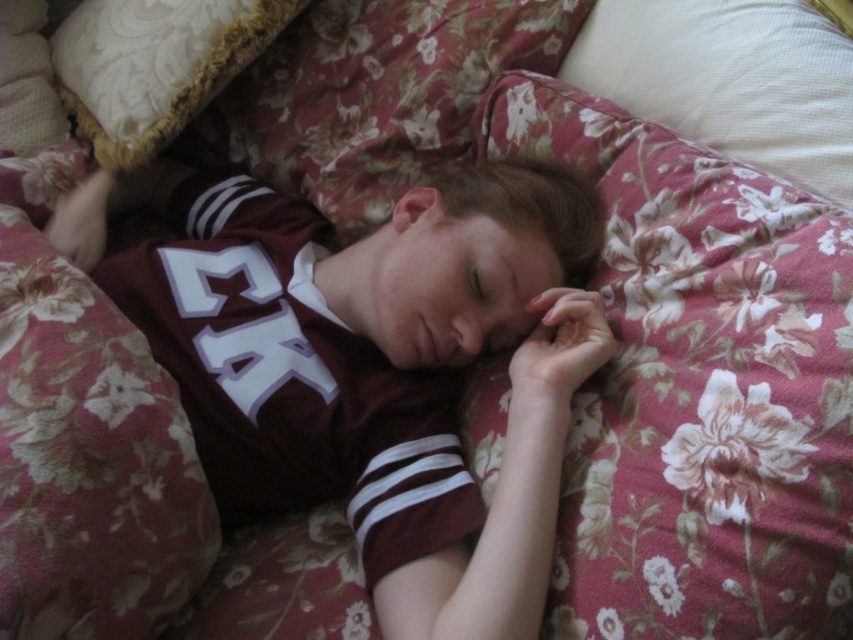
You are a photographer setting up a shoot in this scene. You need to place a small prop between the maroon jersey at center and the white textured pillow at upper right. Based on their positions, where should you place the prop to ensure it is between them?

The maroon jersey at center is positioned on the left side of white textured pillow at upper right, so placing the prop to the right of the maroon jersey at center and to the left of the white textured pillow at upper right would place it between them.

You are a photographer trying to capture the floral fabric at upper center and the white textured pillow at upper right in the same frame. Based on their sizes in the image, which object should you focus on first to ensure both are in the frame?

The floral fabric at upper center is much taller than the white textured pillow at upper right, so you should focus on the floral fabric at upper center first to ensure both fit in the frame.